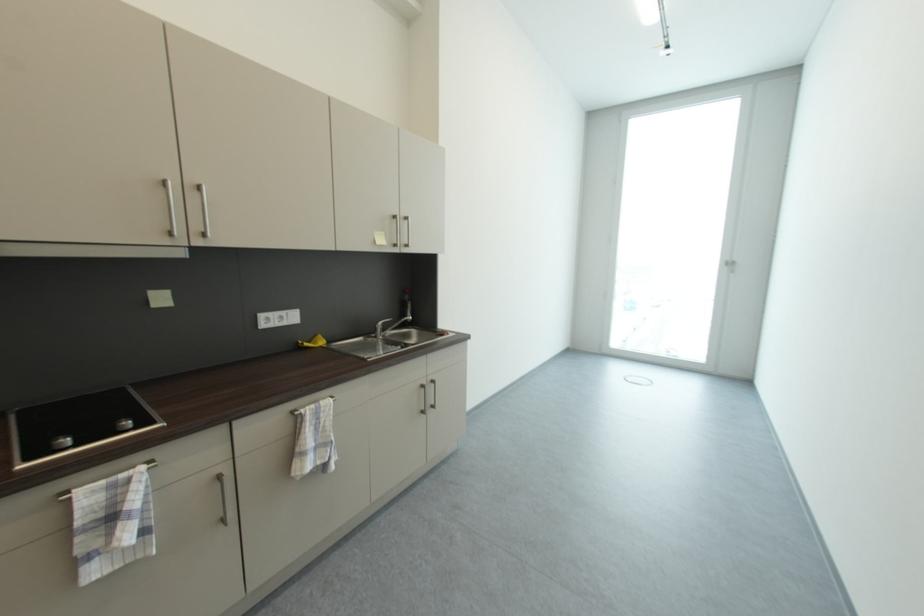
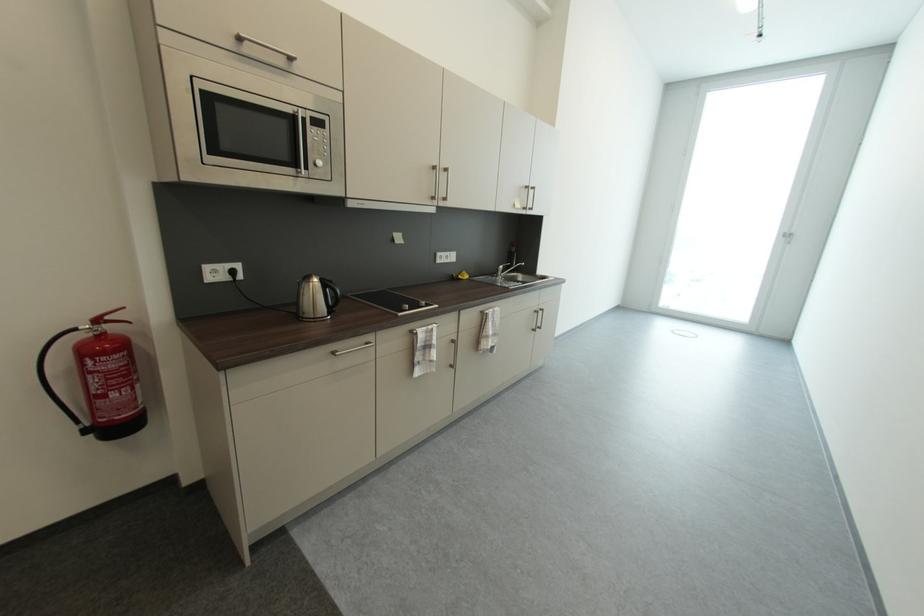
Where in the second image is the point corresponding to (x=736, y=265) from the first image?

(794, 238)